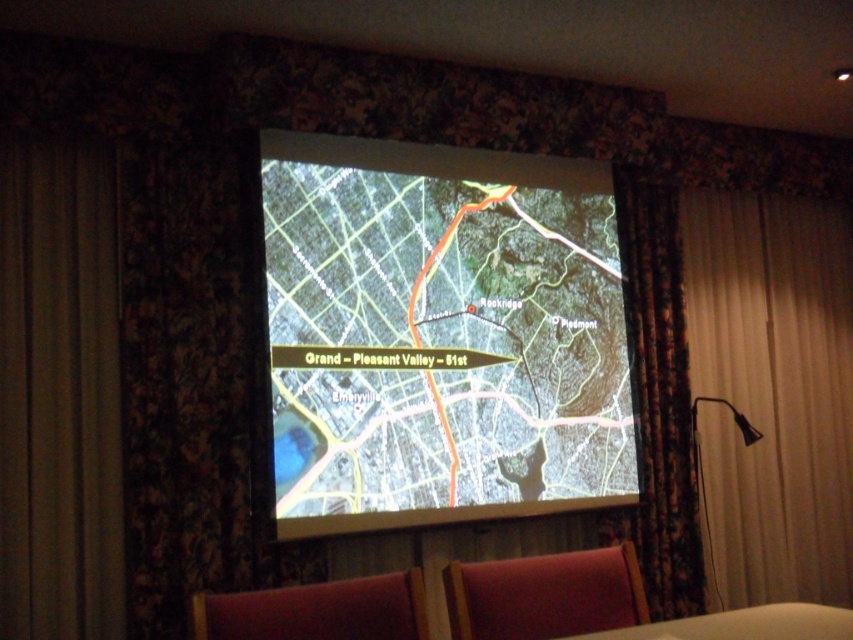
You are setting up a projector in a dark room and need to position it between the white fabric curtain at right and the black fabric lamp at lower right. The projector requires a minimum of 20 inches of space to avoid obstruction. Based on the scene, can the projector be placed between them without blocking either object?

The distance between the white fabric curtain at right and the black fabric lamp at lower right is 19.26 inches. Since this is less than the required 20 inches, the projector cannot be placed between them without potential obstruction.

You are sitting in the audience facing the presentation screen. There are two points marked on the map displayed on the screen. Which point, point at (x=447, y=484) or point at (x=543, y=600), is closer to you?

Point at (x=447, y=484) is further to the camera than point at (x=543, y=600), so the point at (x=543, y=600) is closer to you.

You are in a dimly lit room preparing to present a map on the screen. You notice the dark fabric curtain at left and the floral fabric curtain at right. Which curtain might block the screen if you open it further?

The dark fabric curtain at left is shorter than the floral fabric curtain at right, so opening the dark fabric curtain at left further might block the screen since it is shorter and could extend closer to the screen area.